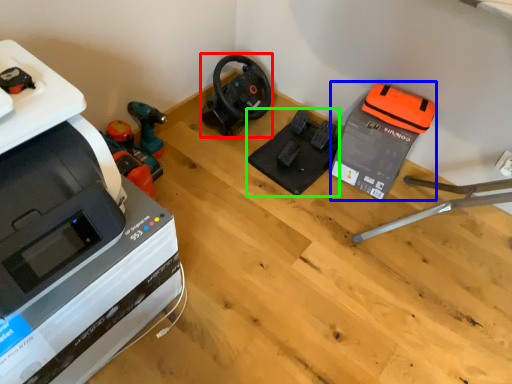
Question: Which is nearer to the vacuum (highlighted by a red box)? equipment (highlighted by a blue box) or equipment (highlighted by a green box).

Choices:
 (A) equipment
 (B) equipment

Answer: (B)